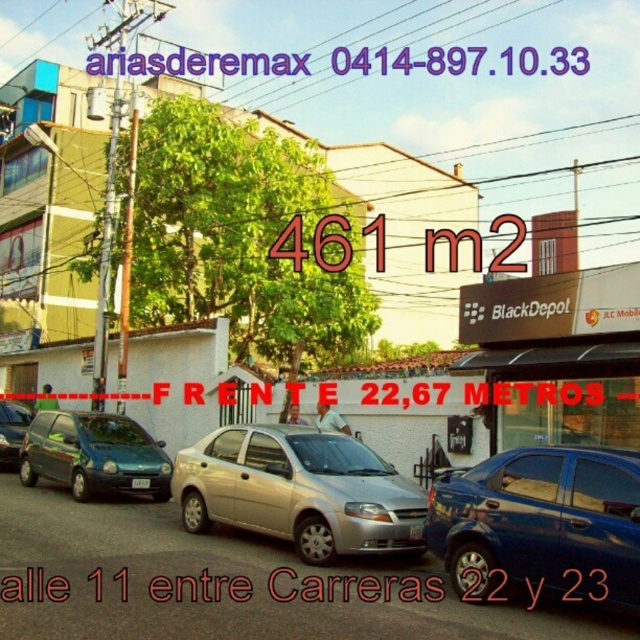
Question: Which is nearer to the blue metallic car at center?

Choices:
 (A) matte black sedan at left
 (B) metallic green hatchback at left
 (C) satin silver sedan at center

Answer: (C)

Question: Which object appears farthest from the camera in this image?

Choices:
 (A) white matte signboard at center
 (B) metallic green hatchback at left

Answer: (B)

Question: Is blue metallic car at center wider than satin silver sedan at center?

Choices:
 (A) no
 (B) yes

Answer: (A)

Question: Observing the image, what is the correct spatial positioning of satin silver sedan at center in reference to matte black sedan at left?

Choices:
 (A) above
 (B) below

Answer: (A)

Question: Is blue metallic car at center bigger than matte black sedan at left?

Choices:
 (A) yes
 (B) no

Answer: (B)

Question: Which point is closer to the camera taking this photo?

Choices:
 (A) (582, 417)
 (B) (138, 481)

Answer: (A)